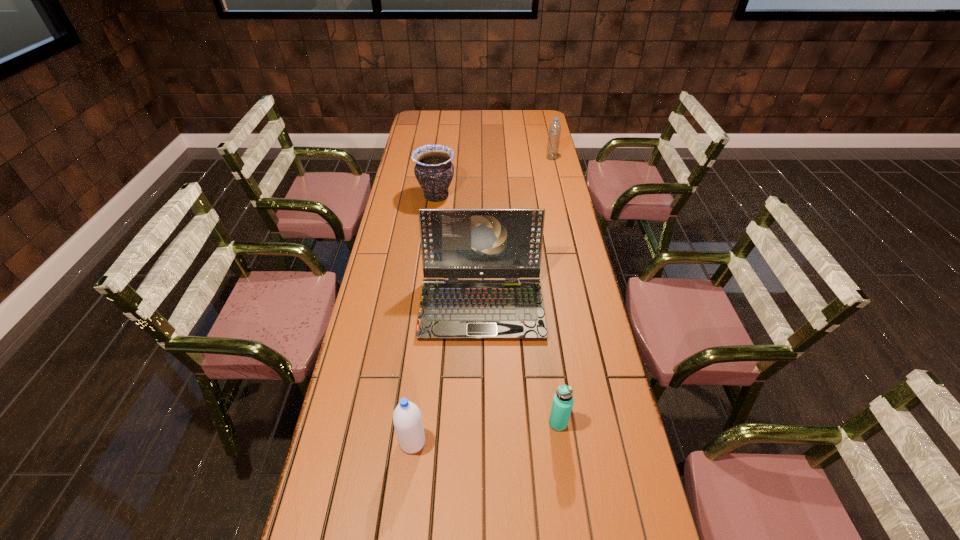
Where is `the tallest object`? Image resolution: width=960 pixels, height=540 pixels. the tallest object is located at coordinates (456, 243).

Identify the location of the third nearest object. The image size is (960, 540). click(x=456, y=243).

The image size is (960, 540). In order to click on the farthest object in this screenshot , I will do `click(555, 128)`.

Locate an element on the screen. the farthest water bottle is located at coordinates (555, 128).

Find the location of a particular element. Image resolution: width=960 pixels, height=540 pixels. pottery is located at coordinates (434, 171).

Image resolution: width=960 pixels, height=540 pixels. In order to click on the leftmost water bottle in this screenshot , I will do `click(407, 419)`.

I want to click on the shortest object, so click(x=563, y=400).

This screenshot has width=960, height=540. In order to click on the shortest water bottle in this screenshot , I will do `click(563, 400)`.

The height and width of the screenshot is (540, 960). I want to click on free spot located on the screen of the tallest object, so click(482, 434).

Find the location of a particular element. The height and width of the screenshot is (540, 960). vacant region located on the back of the farthest water bottle is located at coordinates (548, 141).